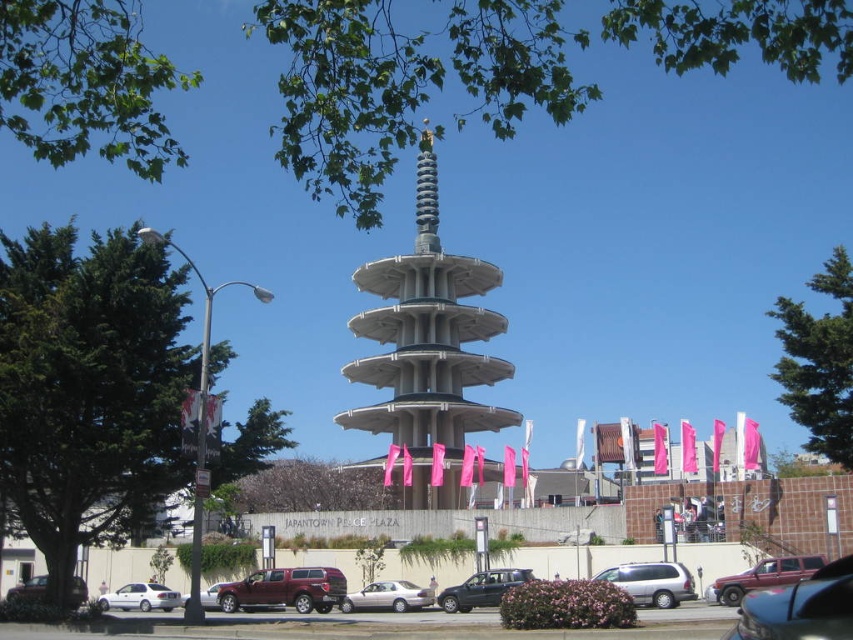
Question: Does metallic maroon suv at lower right appear under matte black car at center?

Choices:
 (A) no
 (B) yes

Answer: (A)

Question: Is metallic maroon suv at lower right above satin silver spire at center?

Choices:
 (A) no
 (B) yes

Answer: (A)

Question: Which point is closer to the camera taking this photo?

Choices:
 (A) (689, 580)
 (B) (358, 596)
 (C) (844, 557)

Answer: (C)

Question: Which point is farther to the camera?

Choices:
 (A) metallic silver car at lower left
 (B) metallic silver car at center

Answer: (A)

Question: Which point is farther to the camera?

Choices:
 (A) maroon matte truck at lower left
 (B) metallic silver car at center
 (C) satin silver spire at center

Answer: (A)

Question: Can you confirm if metallic maroon suv at lower right is positioned above silver metallic sedan at center?

Choices:
 (A) yes
 (B) no

Answer: (A)